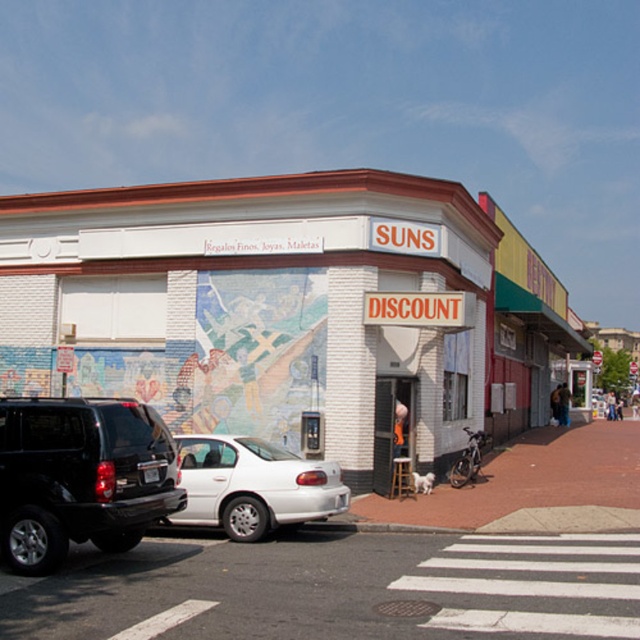
Can you confirm if white asphalt at lower left is bigger than black matte suv at left?

Yes, white asphalt at lower left is bigger than black matte suv at left.

Is point (86, 637) positioned behind point (45, 468)?

That is False.

The height and width of the screenshot is (640, 640). I want to click on white asphalt at lower left, so click(x=337, y=588).

Is white brick building at center wider than black matte suv at left?

Yes.

Does white brick building at center come in front of black matte suv at left?

That is False.

Which is in front, point (132, 216) or point (112, 435)?

Point (112, 435) is in front.

Locate an element on the screen. white brick building at center is located at coordinates (257, 301).

Is black matte suv at left positioned at the back of white matte sedan at center?

No, black matte suv at left is in front of white matte sedan at center.

Can you confirm if black matte suv at left is thinner than white matte sedan at center?

Correct, black matte suv at left's width is less than white matte sedan at center's.

Which is behind, point (65, 550) or point (253, 532)?

The point (253, 532) is more distant.

Find the location of a particular element. The height and width of the screenshot is (640, 640). black matte suv at left is located at coordinates (81, 476).